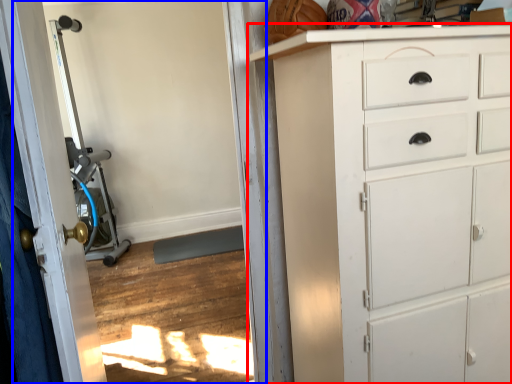
Question: Which of the following is the farthest to the observer, chest of drawers (highlighted by a red box) or screen door (highlighted by a blue box)?

Choices:
 (A) chest of drawers
 (B) screen door

Answer: (B)